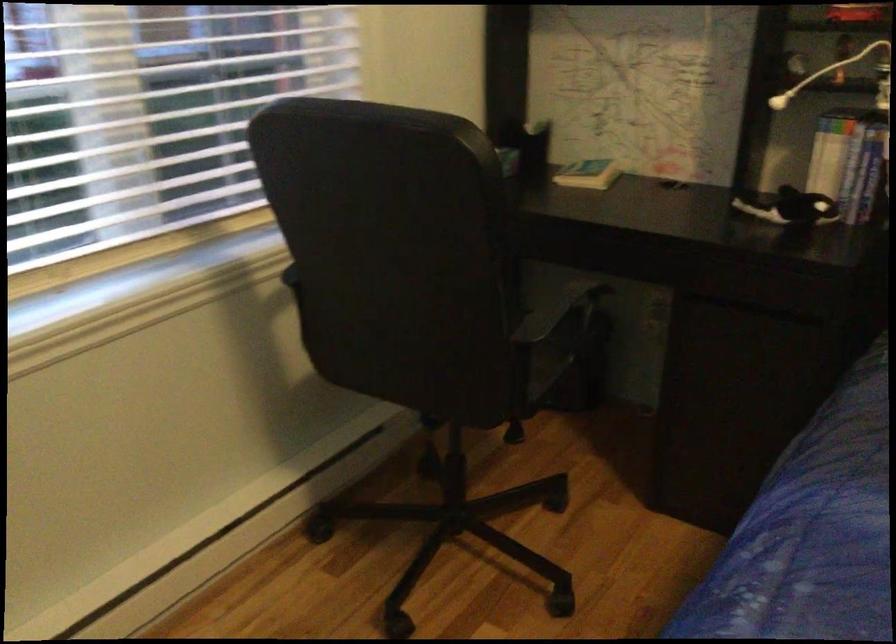
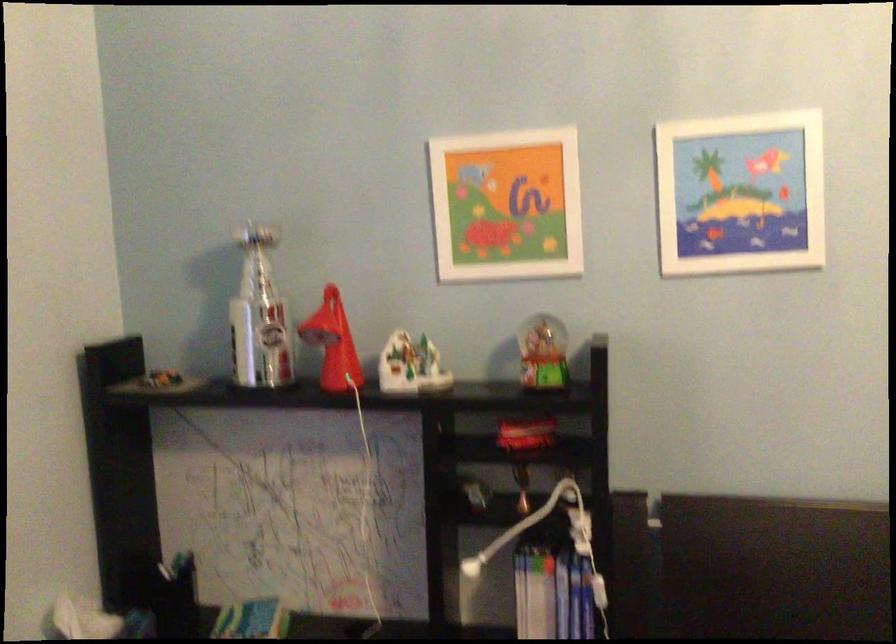
What movement of the cameraman would produce the second image?

The cameraman walked toward right, forward.